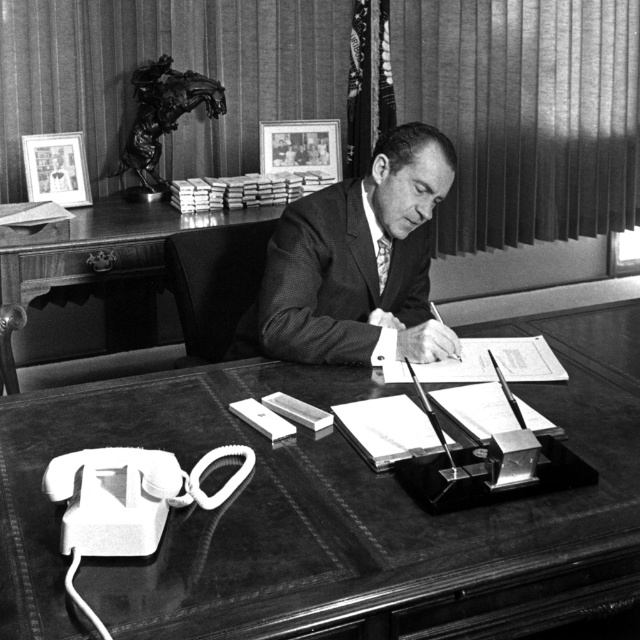
Which of these two, smooth suit at center or wooden desk at center, stands taller?

wooden desk at center

Can you confirm if smooth suit at center is shorter than wooden desk at center?

Correct, smooth suit at center is not as tall as wooden desk at center.

At what (x,y) coordinates should I click in order to perform the action: click on smooth suit at center. Please return your answer as a coordinate pair (x, y). Looking at the image, I should click on tap(360, 260).

Does point (612, 333) come behind point (371, 320)?

That is True.

Which is more to the right, leather at center or smooth suit at center?

From the viewer's perspective, leather at center appears more on the right side.

Is point (344, 547) in front of point (294, 321)?

That is True.

You are a GUI agent. You are given a task and a screenshot of the screen. Output one action in this format:
    pyautogui.click(x=<x>, y=<y>)
    Task: Click on the leather at center
    The width and height of the screenshot is (640, 640).
    Given the screenshot: What is the action you would take?
    pyautogui.click(x=332, y=509)

Is leather at center smaller than wooden desk at center?

Incorrect, leather at center is not smaller in size than wooden desk at center.

Does point (109, 627) come farther from viewer compared to point (0, 352)?

No, (109, 627) is closer to viewer.

Who is more distant from viewer, (458, 592) or (209, 218)?

The point (209, 218) is more distant.

The height and width of the screenshot is (640, 640). Identify the location of leather at center. (332, 509).